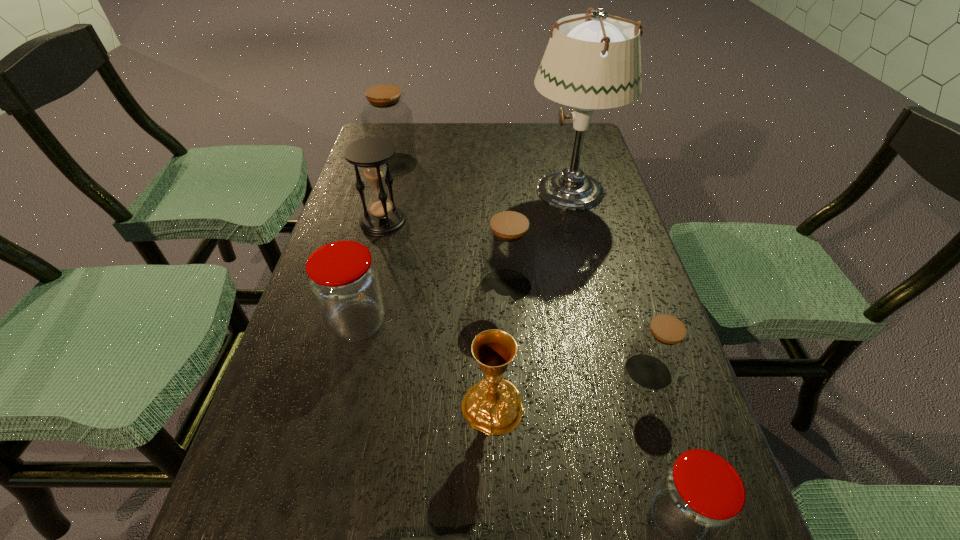
Find the location of `the smallest brown jar`. the smallest brown jar is located at coordinates (659, 347).

At what (x,y) coordinates should I click in order to perform the action: click on free location located on the lampshade of the tallest object. Please return your answer as a coordinate pair (x, y). Looking at the image, I should click on (480, 190).

Locate an element on the screen. This screenshot has height=540, width=960. free space located 0.070m on the lampshade of the tallest object is located at coordinates (501, 190).

Image resolution: width=960 pixels, height=540 pixels. What are the coordinates of `free location located on the lampshade of the tallest object` in the screenshot? It's located at (483, 190).

Where is `free region located on the back of the tallest jar`? The width and height of the screenshot is (960, 540). free region located on the back of the tallest jar is located at coordinates (404, 126).

Where is `vacant position located on the right of the black hourglass`? Image resolution: width=960 pixels, height=540 pixels. vacant position located on the right of the black hourglass is located at coordinates (537, 221).

Identify the location of free spot located on the front of the second brown jar from left to right. Image resolution: width=960 pixels, height=540 pixels. (515, 442).

Where is `vacant space located on the right of the left red jar`? The image size is (960, 540). vacant space located on the right of the left red jar is located at coordinates (552, 323).

Image resolution: width=960 pixels, height=540 pixels. What are the coordinates of `blank space located on the left of the chalice` in the screenshot? It's located at (314, 406).

In order to click on vacant region located 0.150m on the left of the smallest brown jar in this screenshot , I will do `click(544, 373)`.